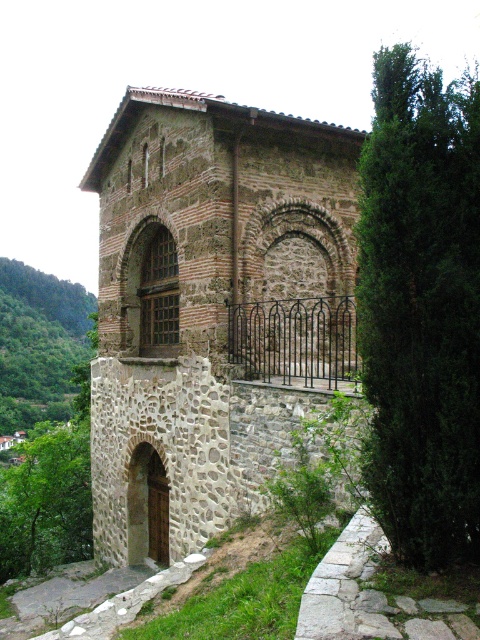
Question: Does stone textured archway at center have a larger size compared to brown stone archway at lower left?

Choices:
 (A) yes
 (B) no

Answer: (A)

Question: Is stone textured archway at center below brown stone archway at lower left?

Choices:
 (A) no
 (B) yes

Answer: (A)

Question: Among these objects, which one is nearest to the camera?

Choices:
 (A) brown stone archway at lower left
 (B) stone textured archway at center

Answer: (B)

Question: Is stone textured archway at center above brown stone archway at lower left?

Choices:
 (A) no
 (B) yes

Answer: (B)